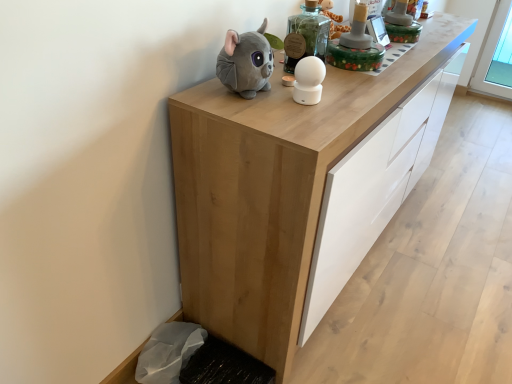
Question: Is the surface of soft gray plush toy at upper center, marked as the second toy in a right-to-left arrangement, in direct contact with natural wood cabinet at center?

Choices:
 (A) no
 (B) yes

Answer: (A)

Question: Is soft gray plush toy at upper center, the 1th toy positioned from the left, taller than natural wood cabinet at center?

Choices:
 (A) yes
 (B) no

Answer: (B)

Question: Can you confirm if soft gray plush toy at upper center, marked as the second toy in a right-to-left arrangement, is shorter than natural wood cabinet at center?

Choices:
 (A) yes
 (B) no

Answer: (A)

Question: Is soft gray plush toy at upper center, the 1th toy positioned from the left, wider than natural wood cabinet at center?

Choices:
 (A) yes
 (B) no

Answer: (B)

Question: Is soft gray plush toy at upper center, marked as the second toy in a right-to-left arrangement, positioned behind natural wood cabinet at center?

Choices:
 (A) no
 (B) yes

Answer: (B)

Question: Considering the positions of soft gray plush toy at upper center, the 1th toy positioned from the left, and white matte ball at center, which is counted as the 1th toy, starting from the right, in the image, is soft gray plush toy at upper center, the 1th toy positioned from the left, wider or thinner than white matte ball at center, which is counted as the 1th toy, starting from the right,?

Choices:
 (A) thin
 (B) wide

Answer: (B)

Question: In the image, is soft gray plush toy at upper center, the 1th toy positioned from the left, positioned in front of or behind white matte ball at center, which is counted as the 1th toy, starting from the right?

Choices:
 (A) behind
 (B) front

Answer: (B)

Question: Is point (266, 39) closer or farther from the camera than point (303, 59)?

Choices:
 (A) closer
 (B) farther

Answer: (A)

Question: Would you say soft gray plush toy at upper center, the 1th toy positioned from the left, is inside or outside white matte ball at center, which is counted as the 1th toy, starting from the right?

Choices:
 (A) inside
 (B) outside

Answer: (B)

Question: Considering the positions of point (270, 48) and point (353, 99), is point (270, 48) closer or farther from the camera than point (353, 99)?

Choices:
 (A) farther
 (B) closer

Answer: (B)

Question: Is soft gray plush toy at upper center, marked as the second toy in a right-to-left arrangement, wider or thinner than natural wood cabinet at center?

Choices:
 (A) thin
 (B) wide

Answer: (A)

Question: Is soft gray plush toy at upper center, the 1th toy positioned from the left, inside the boundaries of natural wood cabinet at center, or outside?

Choices:
 (A) inside
 (B) outside

Answer: (B)

Question: Relative to natural wood cabinet at center, is soft gray plush toy at upper center, the 1th toy positioned from the left, in front or behind?

Choices:
 (A) behind
 (B) front

Answer: (A)

Question: Which is correct: natural wood cabinet at center is inside white matte ball at center, which is counted as the 1th toy, starting from the right, or outside of it?

Choices:
 (A) outside
 (B) inside

Answer: (A)

Question: Looking at their shapes, would you say natural wood cabinet at center is wider or thinner than white matte ball at center, which is counted as the 1th toy, starting from the right?

Choices:
 (A) thin
 (B) wide

Answer: (B)